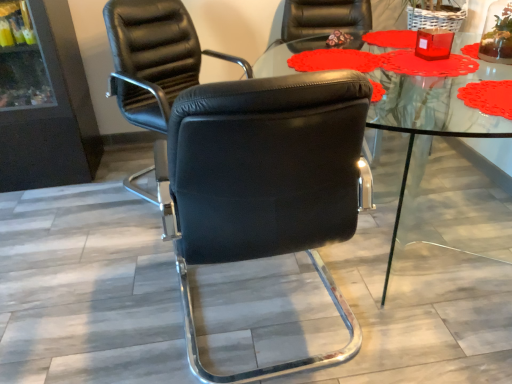
Question: Can you confirm if black leather chair at center, the second chair when ordered from back to front, is positioned to the right of transparent glass table at center?

Choices:
 (A) no
 (B) yes

Answer: (A)

Question: From a real-world perspective, is black leather chair at center, the second chair when ordered from back to front, on transparent glass table at center?

Choices:
 (A) yes
 (B) no

Answer: (A)

Question: Is black leather chair at center, the second chair when ordered from back to front, positioned beyond the bounds of transparent glass table at center?

Choices:
 (A) yes
 (B) no

Answer: (A)

Question: Considering the relative positions of black leather chair at center, the second chair when ordered from back to front, and transparent glass table at center in the image provided, is black leather chair at center, the second chair when ordered from back to front, to the left of transparent glass table at center from the viewer's perspective?

Choices:
 (A) no
 (B) yes

Answer: (B)

Question: Is the surface of black leather chair at center, the second chair when ordered from back to front, in direct contact with transparent glass table at center?

Choices:
 (A) yes
 (B) no

Answer: (B)

Question: From a real-world perspective, is transparent glass table at center physically located above or below black leather chair at center, the second chair when ordered from back to front?

Choices:
 (A) above
 (B) below

Answer: (B)

Question: Is point (433, 76) positioned closer to the camera than point (328, 147)?

Choices:
 (A) farther
 (B) closer

Answer: (A)

Question: In terms of height, does transparent glass table at center look taller or shorter compared to black leather chair at center, the 1th chair from the front?

Choices:
 (A) short
 (B) tall

Answer: (A)

Question: Based on their sizes in the image, would you say transparent glass table at center is bigger or smaller than black leather chair at center, the 1th chair from the front?

Choices:
 (A) small
 (B) big

Answer: (B)

Question: From the image's perspective, relative to black leather chair at center, which ranks as the 2th chair in front-to-back order, is transparent glass table at center above or below?

Choices:
 (A) above
 (B) below

Answer: (B)

Question: From a real-world perspective, relative to black leather chair at center, acting as the 1th chair starting from the back, is transparent glass table at center vertically above or below?

Choices:
 (A) above
 (B) below

Answer: (B)

Question: Is transparent glass table at center taller or shorter than black leather chair at center, acting as the 1th chair starting from the back?

Choices:
 (A) short
 (B) tall

Answer: (A)

Question: Choose the correct answer: Is transparent glass table at center inside black leather chair at center, acting as the 1th chair starting from the back, or outside it?

Choices:
 (A) inside
 (B) outside

Answer: (B)

Question: Is black leather chair at center, which ranks as the 2th chair in front-to-back order, situated inside black leather chair at center, the second chair when ordered from back to front, or outside?

Choices:
 (A) inside
 (B) outside

Answer: (B)

Question: From a real-world perspective, is black leather chair at center, which ranks as the 2th chair in front-to-back order, physically located above or below black leather chair at center, the 1th chair from the front?

Choices:
 (A) below
 (B) above

Answer: (B)